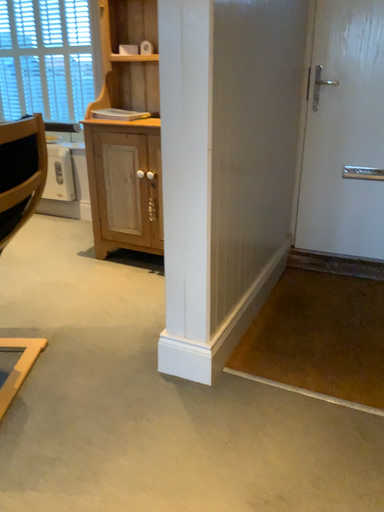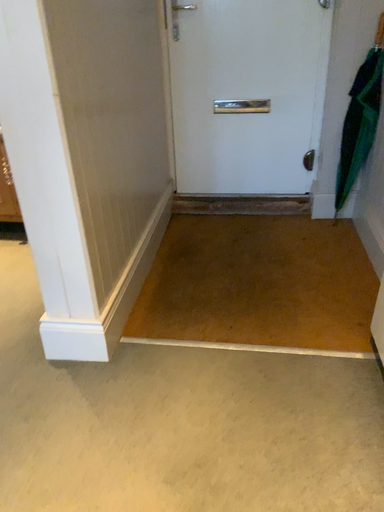
Question: Which way did the camera rotate in the video?

Choices:
 (A) rotated left
 (B) rotated right

Answer: (B)